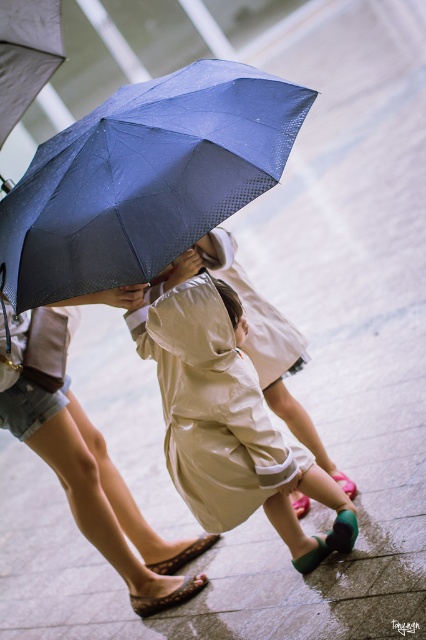
You are standing in the rain and see two people under an umbrella. The people are wearing the matte blue umbrella at center and the beige satin raincoat at center. Which one is positioned more to the left?

The matte blue umbrella at center is positioned to the left of the beige satin raincoat at center.

You are a photographer trying to capture a clear shot of the beige satin raincoat at center. Since you are standing behind the matte blue umbrella at center, can you adjust your position to avoid the umbrella blocking the view?

The matte blue umbrella at center is closer to the viewer than the beige satin raincoat at center, so if you move your position slightly to the side or step forward, you can position yourself so the beige satin raincoat at center is visible beyond the matte blue umbrella at center.